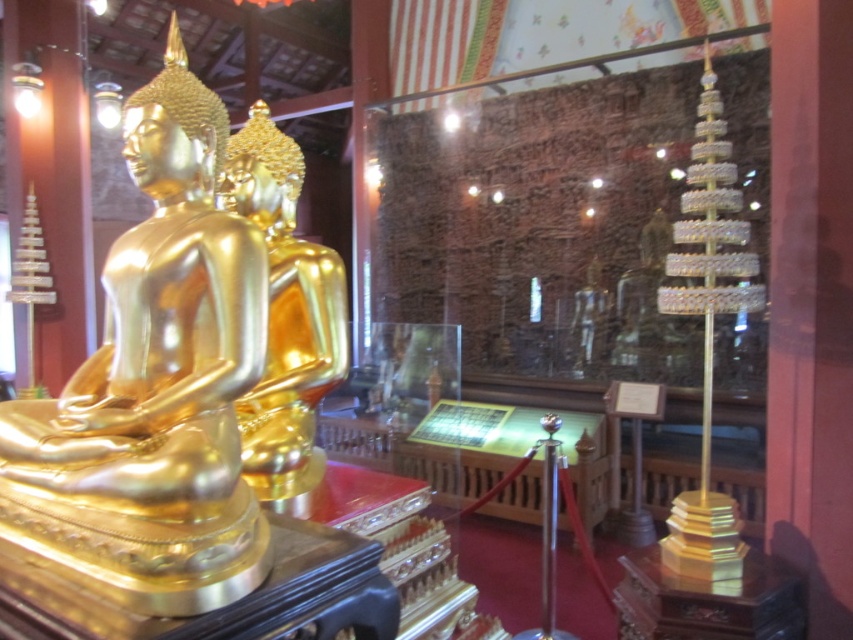
Does point (225, 227) come farther from viewer compared to point (296, 362)?

No, it is in front of (296, 362).

Can you confirm if gold shiny statue at left is shorter than gold shiny statue at center?

Correct, gold shiny statue at left is not as tall as gold shiny statue at center.

Who is more forward, (x=132, y=273) or (x=297, y=394)?

Positioned in front is point (x=132, y=273).

The height and width of the screenshot is (640, 853). What are the coordinates of `gold shiny statue at left` in the screenshot? It's located at (155, 385).